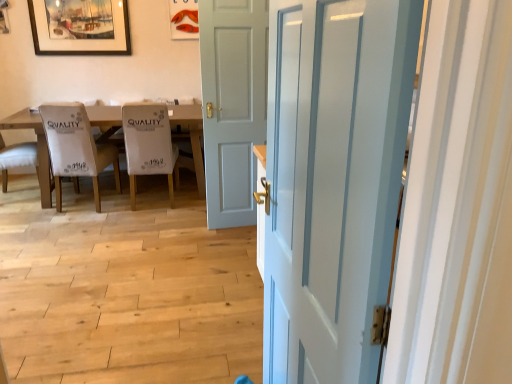
Identify the location of free point in front of wooden table at left. The image size is (512, 384). (105, 238).